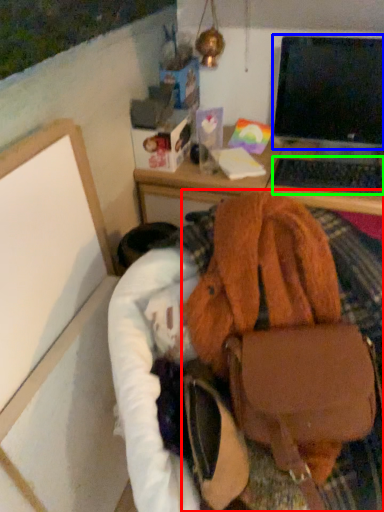
Question: Which object is the closest to the handbag (highlighted by a red box)? Choose among these: computer monitor (highlighted by a blue box) or computer keyboard (highlighted by a green box).

Choices:
 (A) computer monitor
 (B) computer keyboard

Answer: (B)